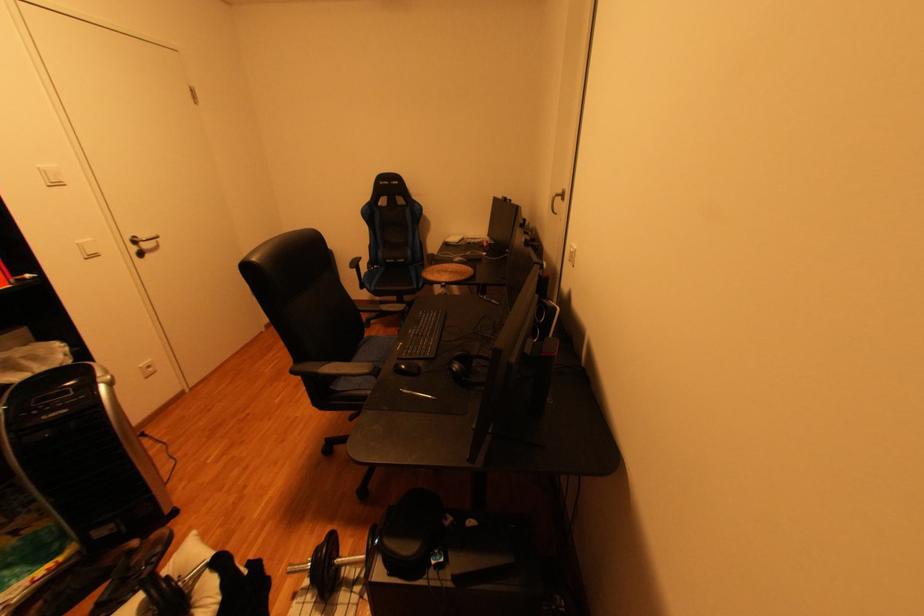
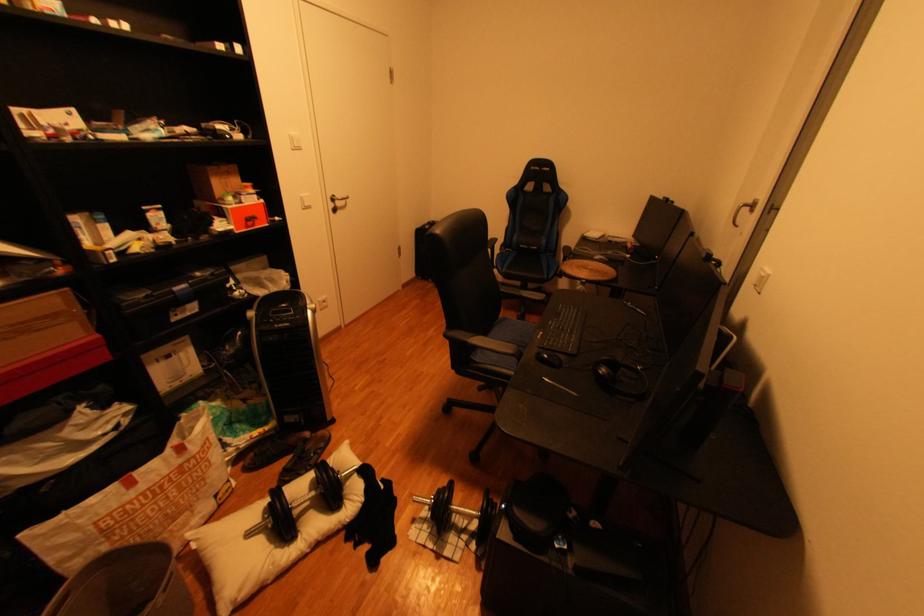
Find the pixel in the second image that matches (x=146, y=238) in the first image.

(345, 197)